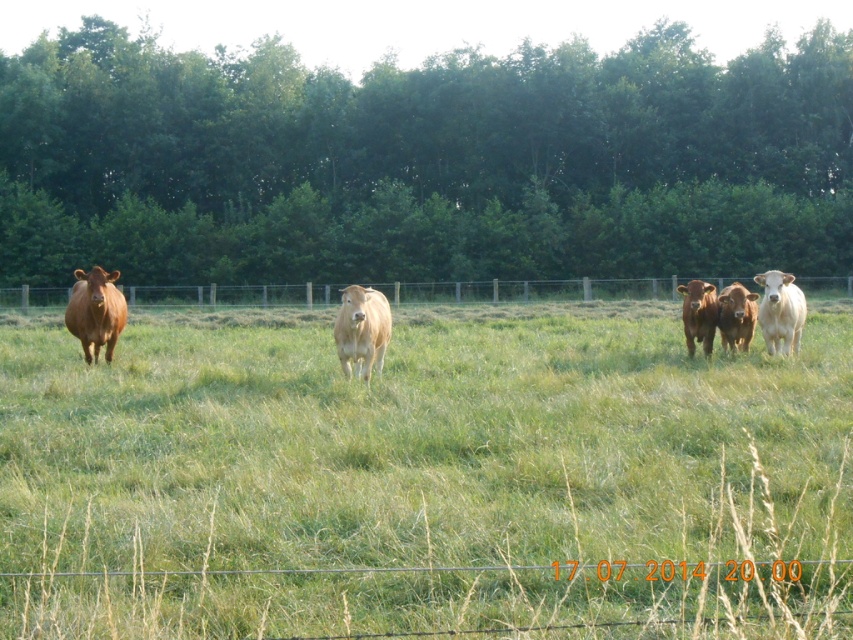
You are standing in front of a fence that separates you from a grassy field with cows. There are two points marked on the ground in the field. One is at coordinate point (567, 554) and the other is at point (720, 304). Which of these two points is closer to you?

Point (567, 554) is closer to the viewer than point (720, 304).

You are standing in front of a wire fence that separates you from the field. You see the green grassy field at center and the brown smooth cow at right. Which object is closer to the fence?

The green grassy field at center is closer to the fence because it is positioned below the brown smooth cow at right, meaning the cow is further away from the fence than the field.